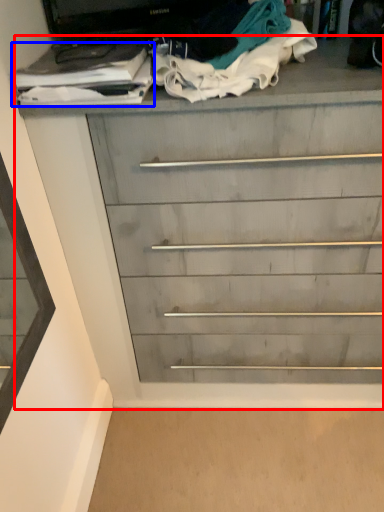
Question: Among these objects, which one is nearest to the camera, chest of drawers (highlighted by a red box) or clothing (highlighted by a blue box)?

Choices:
 (A) chest of drawers
 (B) clothing

Answer: (A)